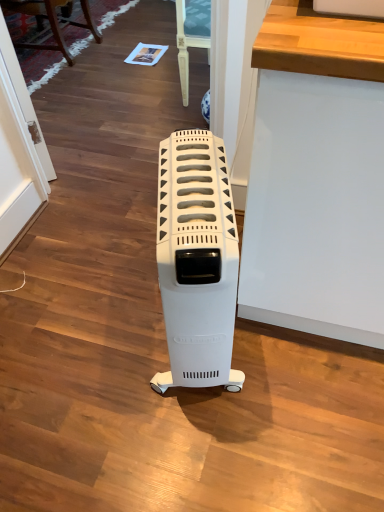
Question: Is wooden chair at upper left inside or outside of white plastic heater at center?

Choices:
 (A) outside
 (B) inside

Answer: (A)

Question: From a real-world perspective, is wooden chair at upper left above or below white plastic heater at center?

Choices:
 (A) above
 (B) below

Answer: (B)

Question: Considering the positions of point (41, 26) and point (228, 244), is point (41, 26) closer or farther from the camera than point (228, 244)?

Choices:
 (A) closer
 (B) farther

Answer: (B)

Question: From the image's perspective, is white plastic heater at center located above or below wooden chair at upper left?

Choices:
 (A) above
 (B) below

Answer: (B)

Question: Looking at their shapes, would you say white plastic heater at center is wider or thinner than wooden chair at upper left?

Choices:
 (A) wide
 (B) thin

Answer: (B)

Question: In terms of size, does white plastic heater at center appear bigger or smaller than wooden chair at upper left?

Choices:
 (A) small
 (B) big

Answer: (A)

Question: Is point (185, 155) closer or farther from the camera than point (56, 3)?

Choices:
 (A) closer
 (B) farther

Answer: (A)